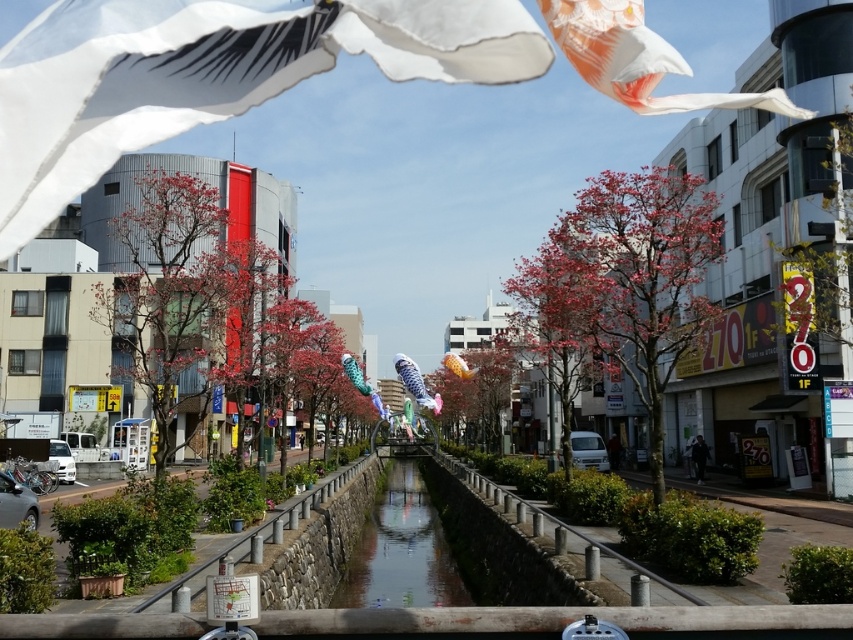
Which is more to the right, white fabric kite at upper center or yellow fabric kite at center?

Positioned to the right is yellow fabric kite at center.

Is point (474, 24) closer to camera compared to point (456, 372)?

Yes, it is.

Is point (24, 106) more distant than point (471, 369)?

No, (24, 106) is in front of (471, 369).

In order to click on white fabric kite at upper center in this screenshot , I will do `click(210, 74)`.

Does white fabric kite at upper center have a greater width compared to blue fabric kite at center?

Incorrect, white fabric kite at upper center's width does not surpass blue fabric kite at center's.

Between point (405, 68) and point (404, 380), which one is positioned behind?

Point (404, 380)

Is point (183, 106) positioned before point (393, 360)?

Yes, point (183, 106) is in front of point (393, 360).

Image resolution: width=853 pixels, height=640 pixels. In order to click on white fabric kite at upper center in this screenshot , I will do `click(210, 74)`.

Does white paper kite at upper right appear over yellow fabric kite at center?

Yes.

Where is `white paper kite at upper right`? Image resolution: width=853 pixels, height=640 pixels. white paper kite at upper right is located at coordinates (637, 60).